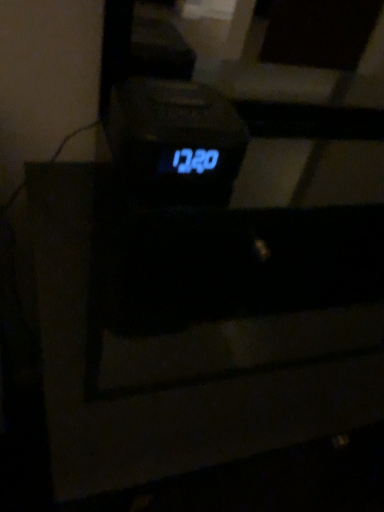
Question: Would you consider blue led display at center to be distant from black plastic drawer at center?

Choices:
 (A) no
 (B) yes

Answer: (A)

Question: From a real-world perspective, is blue led display at center under black plastic drawer at center?

Choices:
 (A) yes
 (B) no

Answer: (B)

Question: Is blue led display at center located outside black plastic drawer at center?

Choices:
 (A) yes
 (B) no

Answer: (A)

Question: Is blue led display at center facing towards black plastic drawer at center?

Choices:
 (A) yes
 (B) no

Answer: (B)

Question: Would you say black plastic drawer at center is part of blue led display at center's contents?

Choices:
 (A) no
 (B) yes

Answer: (A)

Question: Does blue led display at center have a lesser width compared to black plastic drawer at center?

Choices:
 (A) yes
 (B) no

Answer: (A)

Question: Does black plastic drawer at center have a smaller size compared to blue led display at center?

Choices:
 (A) no
 (B) yes

Answer: (A)

Question: Could blue led display at center be considered to be inside black plastic drawer at center?

Choices:
 (A) yes
 (B) no

Answer: (B)

Question: Is black plastic drawer at center next to blue led display at center and touching it?

Choices:
 (A) yes
 (B) no

Answer: (B)

Question: Is black plastic drawer at center positioned with its back to blue led display at center?

Choices:
 (A) no
 (B) yes

Answer: (A)

Question: Is black plastic drawer at center shorter than blue led display at center?

Choices:
 (A) no
 (B) yes

Answer: (A)

Question: Is black plastic drawer at center positioned beyond the bounds of blue led display at center?

Choices:
 (A) yes
 (B) no

Answer: (A)

Question: Considering the positions of point 178,96 and point 110,192, is point 178,96 closer or farther from the camera than point 110,192?

Choices:
 (A) farther
 (B) closer

Answer: (B)